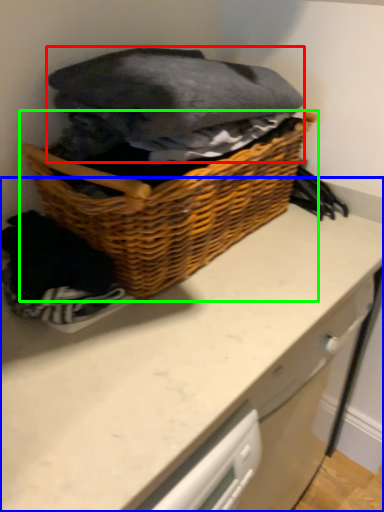
Question: Estimate the real-world distances between objects in this image. Which object is farther from clothing (highlighted by a red box), counter (highlighted by a blue box) or picnic basket (highlighted by a green box)?

Choices:
 (A) counter
 (B) picnic basket

Answer: (A)